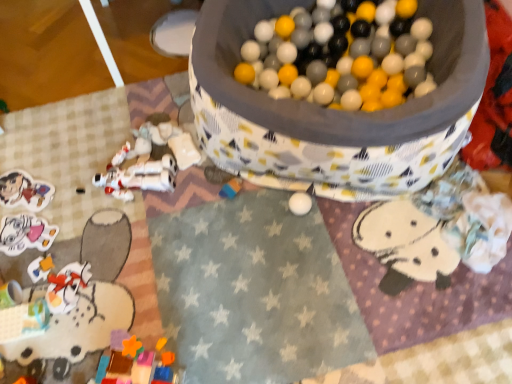
Locate an element on the screen. free space that is in between plastic toy figure at lower left, placed as the fourth toy when sorted from right to left, and multicolored plastic blocks at center, acting as the 5th toy starting from the left is located at coordinates (140, 239).